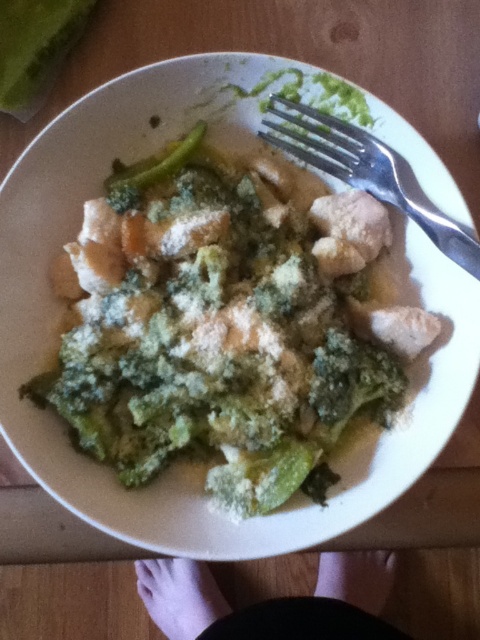
Can you confirm if white powdery chicken at center is wider than silver metallic fork at upper right?

Indeed, white powdery chicken at center has a greater width compared to silver metallic fork at upper right.

Who is more distant from viewer, (124, 326) or (367, 141)?

Point (367, 141)

This screenshot has width=480, height=640. Identify the location of white powdery chicken at center. (228, 328).

Who is positioned more to the left, white powdery chicken at center or green leafy vegetable at center?

From the viewer's perspective, green leafy vegetable at center appears more on the left side.

Is white powdery chicken at center thinner than green leafy vegetable at center?

In fact, white powdery chicken at center might be wider than green leafy vegetable at center.

Does point (360, 371) lie behind point (168, 170)?

No, it is not.

Where is `white powdery chicken at center`? The height and width of the screenshot is (640, 480). white powdery chicken at center is located at coordinates (228, 328).

Is pink fabric feet at lower center above green leafy vegetable at center?

No, pink fabric feet at lower center is not above green leafy vegetable at center.

Is pink fabric feet at lower center positioned before green leafy vegetable at center?

No, pink fabric feet at lower center is behind green leafy vegetable at center.

Measure the distance between pink fabric feet at lower center and camera.

They are 36.43 inches apart.

This screenshot has width=480, height=640. I want to click on pink fabric feet at lower center, so click(x=272, y=602).